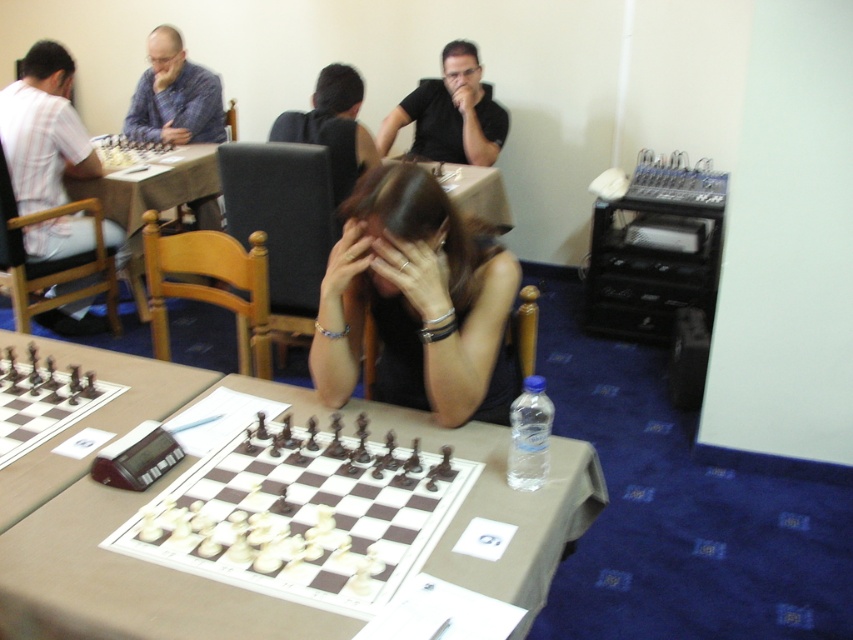
You are a photographer at the chess tournament and need to set up a camera on a tripod. The tripod requires a minimum height of 1.2 meters to capture both the brown wooden table at center and the striped cotton shirt at left clearly. Based on their heights, will the tripod be able to accommodate both objects comfortably?

The brown wooden table at center is shorter than the striped cotton shirt at left. Since the tripod needs to capture both, it must be tall enough to include the taller object, which is the striped cotton shirt at left. If the striped cotton shirt at left exceeds 1.2 meters in height, the tripod may not be sufficient. However, typical shirt heights are much shorter than 1.2 meters, so the tripod should work.

You are a photographer standing at the back of the chess tournament. You need to take a photo of the brown wooden table at center and the striped cotton shirt at left. Based on their positions, which object should appear lower in the photo?

The brown wooden table at center appears lower in the photo because it is positioned below the striped cotton shirt at left.

In the scene shown: You are a photographer at the chess tournament and need to capture a closeup of both the black fabric hair at center and black hair at center without moving the subjects. Can you fit both into the frame if your camera has a 1.5 meter wide lens view?

The black fabric hair at center is 1.39 meters from black hair at center. Since the distance between them is less than the 1.5 meter lens view width, both can be captured in the same frame.